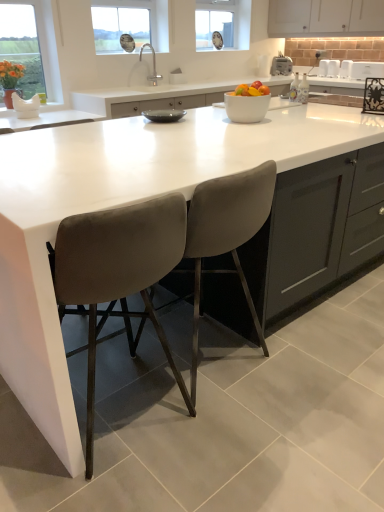
Question: From a real-world perspective, is velvet grey bar stool at center, arranged as the second chair when viewed from the right, positioned over clear glass clock at upper center, placed as the 2th window screen when sorted from left to right, based on gravity?

Choices:
 (A) no
 (B) yes

Answer: (A)

Question: Considering the relative sizes of velvet grey bar stool at center, the 1th chair from the left, and clear glass clock at upper center, which is the 2th window screen in front-to-back order, in the image provided, is velvet grey bar stool at center, the 1th chair from the left, smaller than clear glass clock at upper center, which is the 2th window screen in front-to-back order,?

Choices:
 (A) yes
 (B) no

Answer: (B)

Question: Is velvet grey bar stool at center, arranged as the second chair when viewed from the right, turned away from clear glass clock at upper center, placed as the 2th window screen when sorted from left to right?

Choices:
 (A) yes
 (B) no

Answer: (B)

Question: Considering the relative sizes of velvet grey bar stool at center, the 1th chair from the left, and clear glass clock at upper center, marked as the first window screen in a right-to-left arrangement, in the image provided, is velvet grey bar stool at center, the 1th chair from the left, wider than clear glass clock at upper center, marked as the first window screen in a right-to-left arrangement,?

Choices:
 (A) no
 (B) yes

Answer: (B)

Question: Is velvet grey bar stool at center, the 1th chair from the left, not inside clear glass clock at upper center, which is the 2th window screen in front-to-back order?

Choices:
 (A) yes
 (B) no

Answer: (A)

Question: Considering the relative sizes of velvet grey bar stool at center, arranged as the second chair when viewed from the right, and clear glass clock at upper center, placed as the 2th window screen when sorted from left to right, in the image provided, is velvet grey bar stool at center, arranged as the second chair when viewed from the right, shorter than clear glass clock at upper center, placed as the 2th window screen when sorted from left to right,?

Choices:
 (A) yes
 (B) no

Answer: (B)

Question: Is the position of clear glass clock at upper center, which is the 2th window screen in front-to-back order, more distant than that of white glossy microwave at upper right, positioned as the 3th appliance in back-to-front order?

Choices:
 (A) no
 (B) yes

Answer: (B)

Question: From a real-world perspective, is clear glass clock at upper center, acting as the 1th window screen starting from the top, located beneath white glossy microwave at upper right, the 1th appliance from the right?

Choices:
 (A) no
 (B) yes

Answer: (A)

Question: Can you confirm if clear glass clock at upper center, the 1th window screen when ordered from back to front, is bigger than white glossy microwave at upper right, arranged as the 1th appliance when viewed from the front?

Choices:
 (A) yes
 (B) no

Answer: (A)

Question: Does clear glass clock at upper center, placed as the 2th window screen when sorted from left to right, have a lesser height compared to white glossy microwave at upper right, which is the third appliance in left-to-right order?

Choices:
 (A) no
 (B) yes

Answer: (A)

Question: From the image's perspective, is clear glass clock at upper center, marked as the first window screen in a right-to-left arrangement, beneath white glossy microwave at upper right, which is the third appliance in left-to-right order?

Choices:
 (A) yes
 (B) no

Answer: (B)

Question: Does clear glass clock at upper center, acting as the 1th window screen starting from the top, turn towards white glossy microwave at upper right, the 1th appliance from the right?

Choices:
 (A) yes
 (B) no

Answer: (A)

Question: From the image's perspective, is white matte cabinet at upper center beneath matte glass window at upper left, which ranks as the 1th window screen in bottom-to-top order?

Choices:
 (A) no
 (B) yes

Answer: (A)